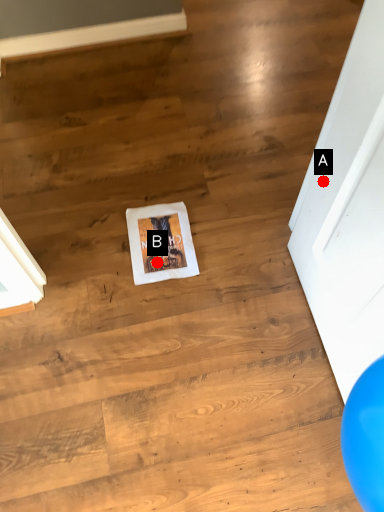
Question: Two points are circled on the image, labeled by A and B beside each circle. Which point is closer to the camera?

Choices:
 (A) A is closer
 (B) B is closer

Answer: (A)